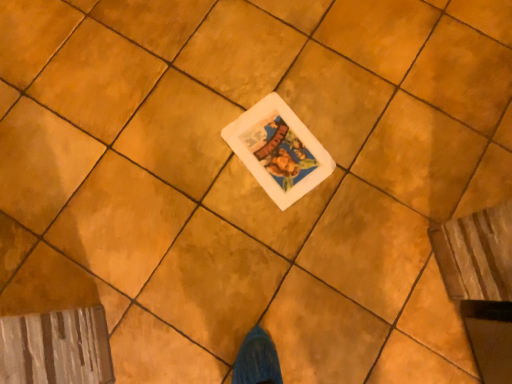
You are a GUI agent. You are given a task and a screenshot of the screen. Output one action in this format:
    pyautogui.click(x=<x>, y=<y>)
    Task: Click on the vacant space underneath white matte comic book at center (from a real-world perspective)
    The width and height of the screenshot is (512, 384).
    Given the screenshot: What is the action you would take?
    pyautogui.click(x=278, y=150)